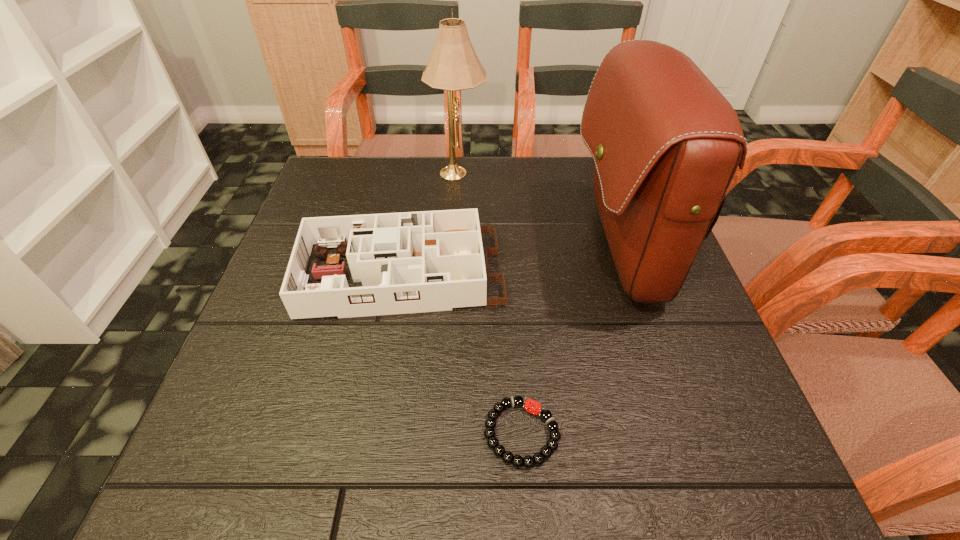
Locate an element on the screen. lampshade is located at coordinates tap(454, 65).

Find the location of a particular element. This screenshot has height=540, width=960. satchel is located at coordinates (666, 143).

The height and width of the screenshot is (540, 960). Find the location of `dollhouse`. dollhouse is located at coordinates (411, 262).

The image size is (960, 540). Identify the location of the shortest object. pos(538,459).

The width and height of the screenshot is (960, 540). I want to click on bracelet, so click(x=538, y=459).

Identify the location of free space located 0.200m on the right of the farthest object. The image size is (960, 540). (559, 171).

The height and width of the screenshot is (540, 960). What are the coordinates of `free space located 0.210m on the open flap of the satchel` in the screenshot? It's located at tap(480, 251).

Identify the location of vacant region located 0.400m on the open flap of the satchel. (395, 251).

Find the location of `free location located on the open flap of the satchel`. free location located on the open flap of the satchel is located at coordinates (489, 251).

At what (x,y) coordinates should I click in order to perform the action: click on free spot located on the right of the second shortest object. Please return your answer as a coordinate pair (x, y). Looking at the image, I should click on (562, 274).